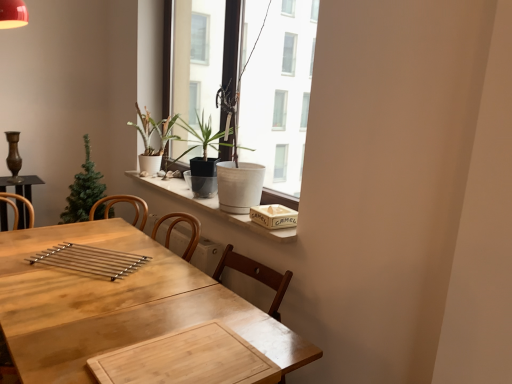
Question: From a real-world perspective, is green matte christmas tree at left, the 3th houseplant in the right-to-left sequence, on top of white marble window sill at upper center?

Choices:
 (A) no
 (B) yes

Answer: (A)

Question: From the image's perspective, is green matte christmas tree at left, the 3th houseplant in the right-to-left sequence, below white marble window sill at upper center?

Choices:
 (A) no
 (B) yes

Answer: (A)

Question: Is there a large distance between green matte christmas tree at left, the 3th houseplant in the right-to-left sequence, and white marble window sill at upper center?

Choices:
 (A) yes
 (B) no

Answer: (B)

Question: Would you say green matte christmas tree at left, the 3th houseplant in the right-to-left sequence, is outside white marble window sill at upper center?

Choices:
 (A) yes
 (B) no

Answer: (A)

Question: Can you confirm if green matte christmas tree at left, the 3th houseplant in the right-to-left sequence, is wider than white marble window sill at upper center?

Choices:
 (A) yes
 (B) no

Answer: (A)

Question: Is green matte christmas tree at left, which is counted as the first houseplant, starting from the left, shorter than white marble window sill at upper center?

Choices:
 (A) yes
 (B) no

Answer: (B)

Question: From a real-world perspective, is white matte pot at upper center below wooden table at center?

Choices:
 (A) no
 (B) yes

Answer: (A)

Question: Is white matte pot at upper center further to the viewer compared to wooden table at center?

Choices:
 (A) no
 (B) yes

Answer: (B)

Question: Is white matte pot at upper center aimed at wooden table at center?

Choices:
 (A) yes
 (B) no

Answer: (B)

Question: Does white matte pot at upper center come in front of wooden table at center?

Choices:
 (A) yes
 (B) no

Answer: (B)

Question: Are white matte pot at upper center and wooden table at center making contact?

Choices:
 (A) yes
 (B) no

Answer: (B)

Question: Are white matte pot at upper center and wooden table at center located far from each other?

Choices:
 (A) no
 (B) yes

Answer: (B)

Question: Is polished metal tray at center outside of wooden textured book at upper right?

Choices:
 (A) no
 (B) yes

Answer: (B)